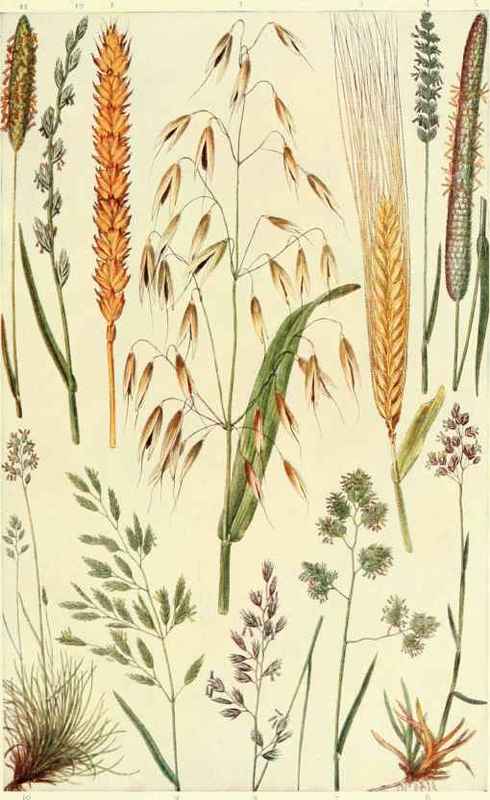
Locate an element on the screen. This screenshot has height=800, width=490. long green and white plant is located at coordinates (471, 62), (453, 221).